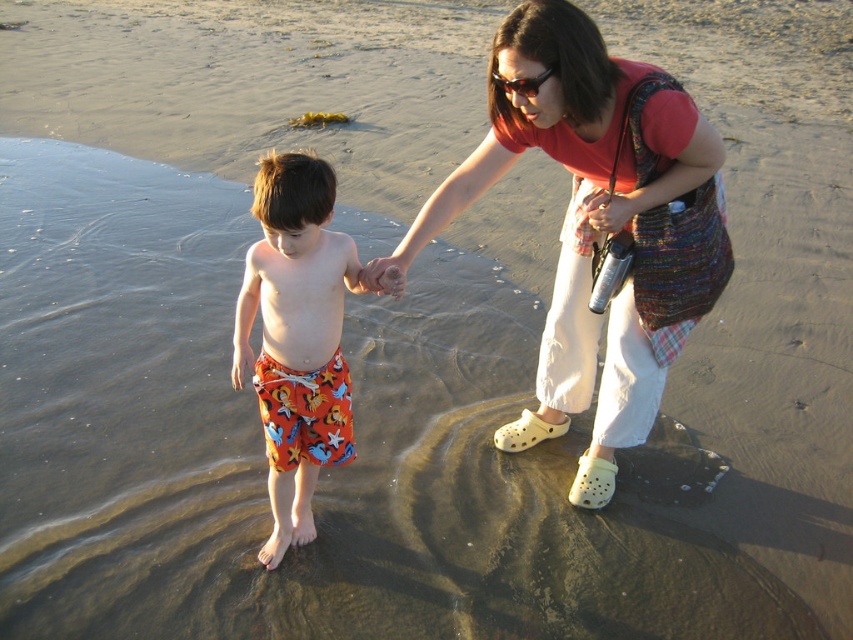
Measure the distance between point (456,180) and camera.

Point (456,180) is 2.55 meters away from camera.

Between matte red shirt at center and printed swim trunks at center, which one is positioned higher?

matte red shirt at center is higher up.

Which is behind, point (563, 273) or point (270, 534)?

Point (563, 273)

Where is `matte red shirt at center`? This screenshot has height=640, width=853. matte red shirt at center is located at coordinates (596, 224).